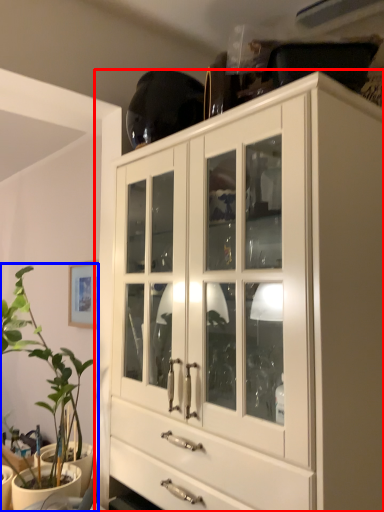
Question: Among these objects, which one is farthest to the camera, cabinetry (highlighted by a red box) or houseplant (highlighted by a blue box)?

Choices:
 (A) cabinetry
 (B) houseplant

Answer: (B)